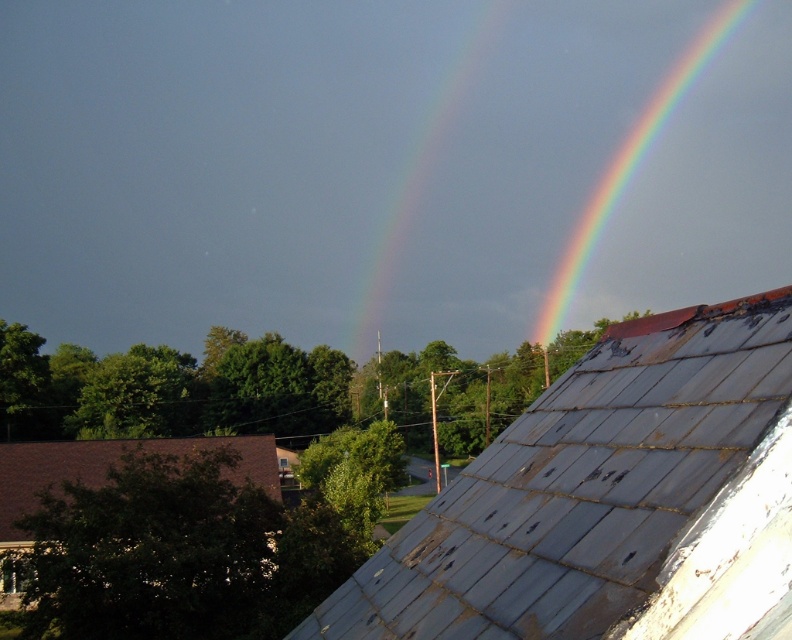
You are standing in a garden looking at the suburban scene. You notice a point marked at coordinates (610,500). What object does this point correspond to?

The point at coordinates (610,500) corresponds to the rusty metal roof at upper right.

From the picture: You are standing on the ground looking at the rusty metal roof at upper right and the rainbow at upper right. How far apart are these two objects?

The rusty metal roof at upper right and rainbow at upper right are 148.98 meters apart from each other.